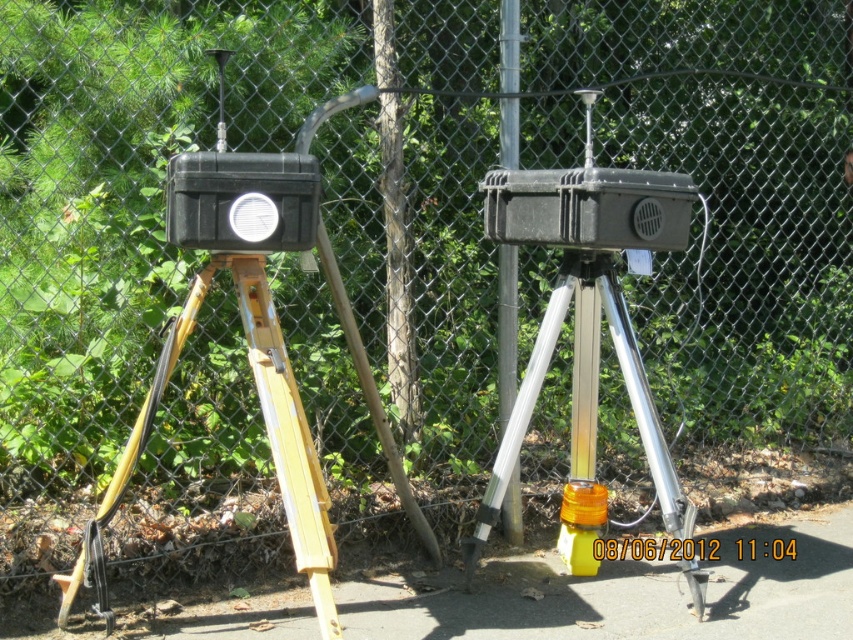
Question: Can you confirm if yellow wood tripod at left is thinner than brushed metal pole at center?

Choices:
 (A) yes
 (B) no

Answer: (B)

Question: Estimate the real-world distances between objects in this image. Which object is farther from the brushed metal pole at center?

Choices:
 (A) silver metallic tripod at center
 (B) metallic pole at center
 (C) yellow wood tripod at left

Answer: (C)

Question: Which of these objects is positioned closest to the metallic pole at center?

Choices:
 (A) yellow wood tripod at left
 (B) silver metallic tripod at center
 (C) brushed metal pole at center

Answer: (C)

Question: Which point appears closest to the camera in this image?

Choices:
 (A) (656, 461)
 (B) (389, 326)
 (C) (508, 502)
 (D) (115, 474)

Answer: (D)

Question: Is the position of yellow wood tripod at left more distant than that of brushed metal pole at center?

Choices:
 (A) no
 (B) yes

Answer: (A)

Question: Does silver metallic tripod at center have a lesser width compared to yellow wood tripod at left?

Choices:
 (A) yes
 (B) no

Answer: (A)